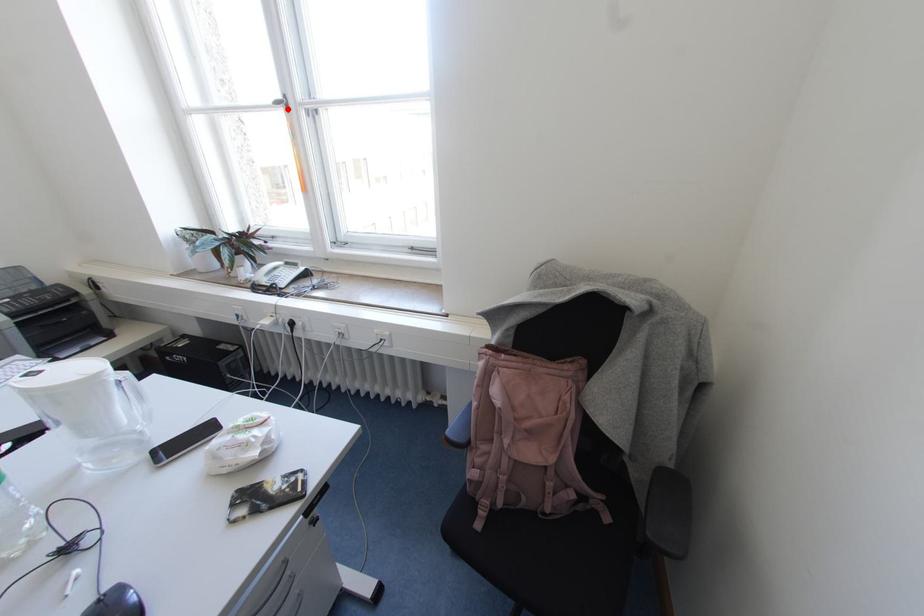
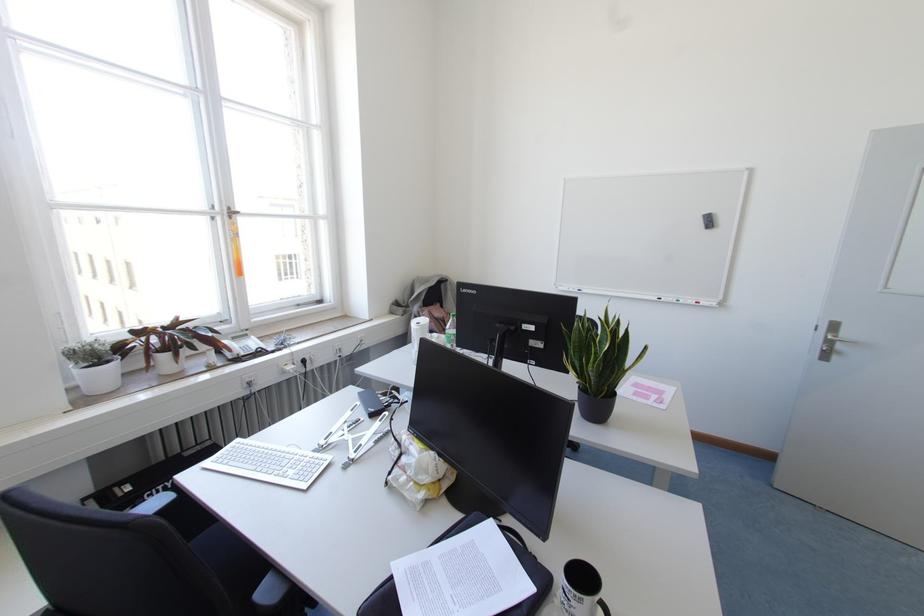
The point at the highlighted location is marked in the first image. Where is the corresponding point in the second image?

(229, 217)